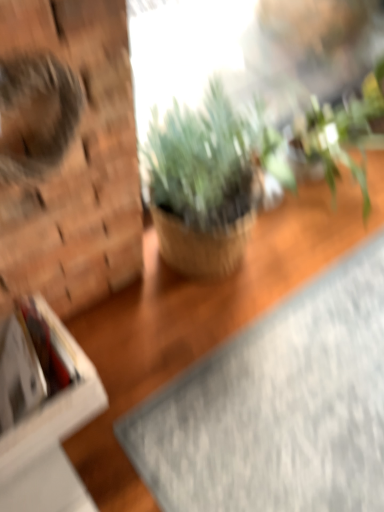
Image resolution: width=384 pixels, height=512 pixels. Describe the element at coordinates (42, 410) in the screenshot. I see `white cardboard box at left` at that location.

You are a GUI agent. You are given a task and a screenshot of the screen. Output one action in this format:
    pyautogui.click(x=<x>, y=<y>)
    Task: Click on the green leafy plant at upper right, which ranks as the second houseplant in left-to-right order
    This screenshot has width=384, height=512.
    Given the screenshot: What is the action you would take?
    pyautogui.click(x=342, y=131)

How much space does green matte plant at center, which is counted as the first houseplant, starting from the left, occupy vertically?

green matte plant at center, which is counted as the first houseplant, starting from the left, is 23.15 inches tall.

This screenshot has height=512, width=384. Describe the element at coordinates (278, 407) in the screenshot. I see `gray textured yoga mat at lower right` at that location.

Image resolution: width=384 pixels, height=512 pixels. I want to click on white cardboard box at left, so click(x=42, y=410).

In terms of size, does white cardboard box at left appear bigger or smaller than fuzzy brown cat at left?

In the image, white cardboard box at left appears to be larger than fuzzy brown cat at left.

Is white cardboard box at left touching fuzzy brown cat at left?

white cardboard box at left and fuzzy brown cat at left are not in contact.

Between white cardboard box at left and fuzzy brown cat at left, which one appears on the left side from the viewer's perspective?

Positioned to the left is white cardboard box at left.

Is white cardboard box at left in front of or behind fuzzy brown cat at left in the image?

In the image, white cardboard box at left appears behind fuzzy brown cat at left.

Considering the sizes of green matte plant at center, the 2th houseplant in the right-to-left sequence, and fuzzy brown cat at left in the image, is green matte plant at center, the 2th houseplant in the right-to-left sequence, bigger or smaller than fuzzy brown cat at left?

green matte plant at center, the 2th houseplant in the right-to-left sequence, is bigger than fuzzy brown cat at left.

Where is `the 1st houseplant to the right of the fuzzy brown cat at left, counting from the anchor's position`? the 1st houseplant to the right of the fuzzy brown cat at left, counting from the anchor's position is located at coordinates (209, 180).

Would you consider green matte plant at center, the 2th houseplant in the right-to-left sequence, to be distant from fuzzy brown cat at left?

No.

Looking at this image, is green matte plant at center, which is counted as the first houseplant, starting from the left, located outside fuzzy brown cat at left?

Absolutely, green matte plant at center, which is counted as the first houseplant, starting from the left, is external to fuzzy brown cat at left.

Is green matte plant at center, which is counted as the first houseplant, starting from the left, not within white cardboard box at left?

Yes, green matte plant at center, which is counted as the first houseplant, starting from the left, is not within white cardboard box at left.

Which is more to the right, green matte plant at center, which is counted as the first houseplant, starting from the left, or white cardboard box at left?

green matte plant at center, which is counted as the first houseplant, starting from the left.

From a real-world perspective, which is physically below, green matte plant at center, the 2th houseplant in the right-to-left sequence, or white cardboard box at left?

white cardboard box at left.

In terms of size, does green matte plant at center, the 2th houseplant in the right-to-left sequence, appear bigger or smaller than white cardboard box at left?

Clearly, green matte plant at center, the 2th houseplant in the right-to-left sequence, is larger in size than white cardboard box at left.

Which point is more forward, (3,504) or (313,430)?

The point (3,504) is more forward.

How many degrees apart are the facing directions of white cardboard box at left and gray textured yoga mat at lower right?

88.8 degrees separate the facing orientations of white cardboard box at left and gray textured yoga mat at lower right.

Is white cardboard box at left wider than gray textured yoga mat at lower right?

No, white cardboard box at left is not wider than gray textured yoga mat at lower right.

From a real-world perspective, which is physically above, white cardboard box at left or gray textured yoga mat at lower right?

In real-world perspective, white cardboard box at left is above.

Which is in front, white cardboard box at left or green leafy plant at upper right, arranged as the first houseplant when viewed from the right?

Positioned in front is white cardboard box at left.

Is white cardboard box at left turned away from green leafy plant at upper right, which ranks as the second houseplant in left-to-right order?

No, green leafy plant at upper right, which ranks as the second houseplant in left-to-right order, is not at the back of white cardboard box at left.

In the scene shown: Does white cardboard box at left have a greater height compared to green leafy plant at upper right, which ranks as the second houseplant in left-to-right order?

In fact, white cardboard box at left may be shorter than green leafy plant at upper right, which ranks as the second houseplant in left-to-right order.

From a real-world perspective, is white cardboard box at left above or below green leafy plant at upper right, arranged as the first houseplant when viewed from the right?

white cardboard box at left is situated lower than green leafy plant at upper right, arranged as the first houseplant when viewed from the right, in the real world.

Between point (39, 53) and point (337, 441), which one is positioned behind?

The point (337, 441) is behind.

What's the angular difference between fuzzy brown cat at left and gray textured yoga mat at lower right's facing directions?

90.3 degrees separate the facing orientations of fuzzy brown cat at left and gray textured yoga mat at lower right.

Is fuzzy brown cat at left not near gray textured yoga mat at lower right?

fuzzy brown cat at left is near gray textured yoga mat at lower right, not far away.

Is fuzzy brown cat at left surrounding gray textured yoga mat at lower right?

No, gray textured yoga mat at lower right is not surrounded by fuzzy brown cat at left.

From the image's perspective, which one is positioned higher, green matte plant at center, the 2th houseplant in the right-to-left sequence, or green leafy plant at upper right, arranged as the first houseplant when viewed from the right?

green leafy plant at upper right, arranged as the first houseplant when viewed from the right.

Is green matte plant at center, the 2th houseplant in the right-to-left sequence, completely or partially outside of green leafy plant at upper right, which ranks as the second houseplant in left-to-right order?

Indeed, green matte plant at center, the 2th houseplant in the right-to-left sequence, is completely outside green leafy plant at upper right, which ranks as the second houseplant in left-to-right order.

Looking at the image, does green matte plant at center, the 2th houseplant in the right-to-left sequence, seem bigger or smaller compared to green leafy plant at upper right, arranged as the first houseplant when viewed from the right?

In the image, green matte plant at center, the 2th houseplant in the right-to-left sequence, appears to be smaller than green leafy plant at upper right, arranged as the first houseplant when viewed from the right.

Identify the location of houseplant below the green leafy plant at upper right, arranged as the first houseplant when viewed from the right (from the image's perspective). (209, 180).

Where is `cardboard box on the left of fuzzy brown cat at left`? cardboard box on the left of fuzzy brown cat at left is located at coordinates (42, 410).

Where is `the 1st houseplant behind when counting from the fuzzy brown cat at left`? The image size is (384, 512). the 1st houseplant behind when counting from the fuzzy brown cat at left is located at coordinates (209, 180).

From the image, which object appears to be farther from green leafy plant at upper right, which ranks as the second houseplant in left-to-right order, green matte plant at center, the 2th houseplant in the right-to-left sequence, or gray textured yoga mat at lower right?

The object further to green leafy plant at upper right, which ranks as the second houseplant in left-to-right order, is gray textured yoga mat at lower right.

Looking at the image, which one is located closer to white cardboard box at left, fuzzy brown cat at left or green matte plant at center, the 2th houseplant in the right-to-left sequence?

Based on the image, fuzzy brown cat at left appears to be nearer to white cardboard box at left.

Estimate the real-world distances between objects in this image. Which object is further from fuzzy brown cat at left, gray textured yoga mat at lower right or green matte plant at center, which is counted as the first houseplant, starting from the left?

Based on the image, gray textured yoga mat at lower right appears to be further to fuzzy brown cat at left.

Based on their spatial positions, is white cardboard box at left or green matte plant at center, which is counted as the first houseplant, starting from the left, further from fuzzy brown cat at left?

green matte plant at center, which is counted as the first houseplant, starting from the left, is further to fuzzy brown cat at left.

Estimate the real-world distances between objects in this image. Which object is further from green leafy plant at upper right, arranged as the first houseplant when viewed from the right, gray textured yoga mat at lower right or green matte plant at center, the 2th houseplant in the right-to-left sequence?

gray textured yoga mat at lower right lies further to green leafy plant at upper right, arranged as the first houseplant when viewed from the right, than the other object.

Based on their spatial positions, is fuzzy brown cat at left or green matte plant at center, which is counted as the first houseplant, starting from the left, further from green leafy plant at upper right, which ranks as the second houseplant in left-to-right order?

fuzzy brown cat at left lies further to green leafy plant at upper right, which ranks as the second houseplant in left-to-right order, than the other object.

Considering their positions, is gray textured yoga mat at lower right positioned closer to white cardboard box at left than green matte plant at center, the 2th houseplant in the right-to-left sequence?

The object closer to white cardboard box at left is gray textured yoga mat at lower right.

Looking at the image, which one is located closer to green leafy plant at upper right, which ranks as the second houseplant in left-to-right order, fuzzy brown cat at left or white cardboard box at left?

Based on the image, fuzzy brown cat at left appears to be nearer to green leafy plant at upper right, which ranks as the second houseplant in left-to-right order.

This screenshot has height=512, width=384. I want to click on yoga mat between white cardboard box at left and green leafy plant at upper right, arranged as the first houseplant when viewed from the right, in the horizontal direction, so click(x=278, y=407).

The image size is (384, 512). What are the coordinates of `houseplant between fuzzy brown cat at left and gray textured yoga mat at lower right in the vertical direction` in the screenshot? It's located at (209, 180).

Identify the location of houseplant situated between fuzzy brown cat at left and green leafy plant at upper right, arranged as the first houseplant when viewed from the right, from left to right. Image resolution: width=384 pixels, height=512 pixels. (209, 180).

This screenshot has width=384, height=512. In order to click on houseplant between white cardboard box at left and gray textured yoga mat at lower right in this screenshot , I will do `click(209, 180)`.